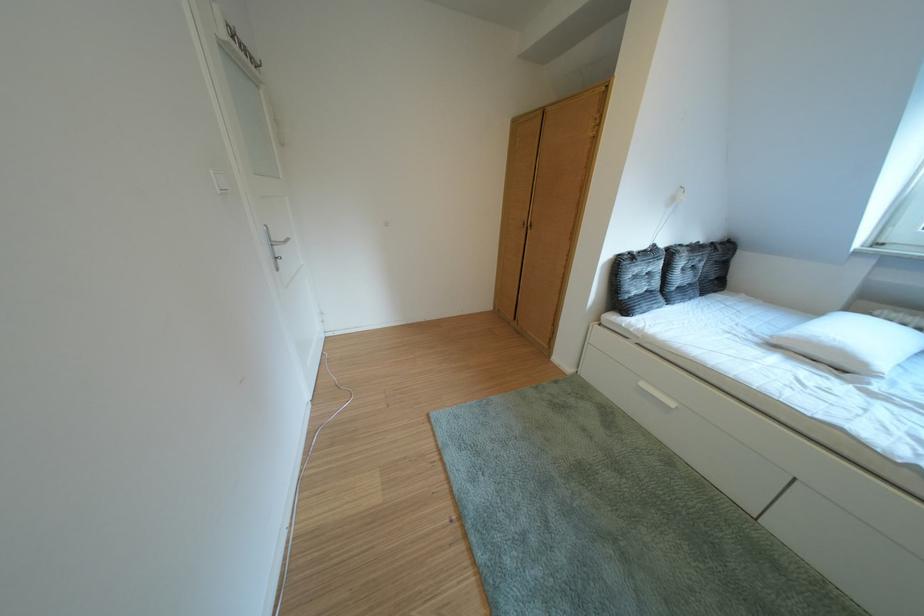
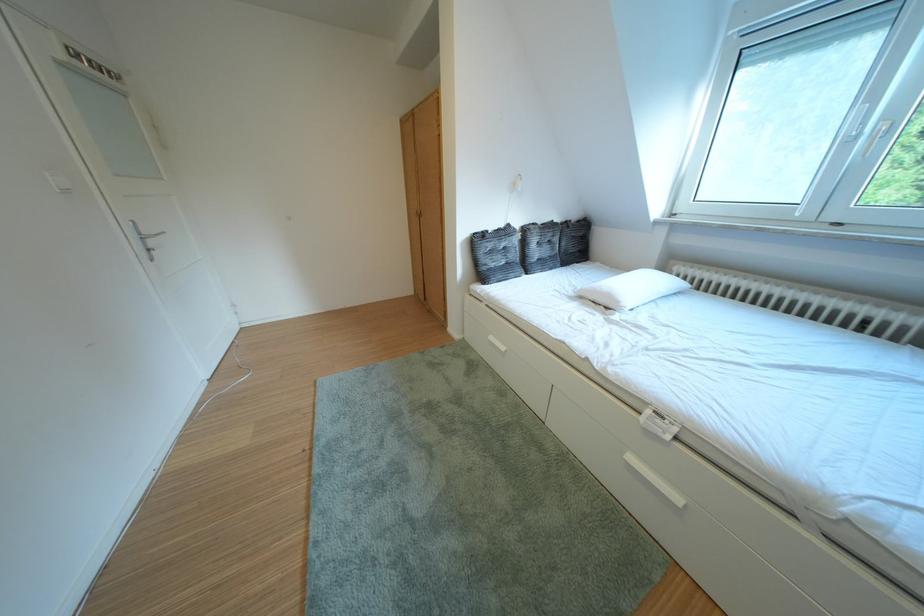
Question: How did the camera likely rotate?

Choices:
 (A) Left
 (B) Right
 (C) Up
 (D) Down

Answer: (B)